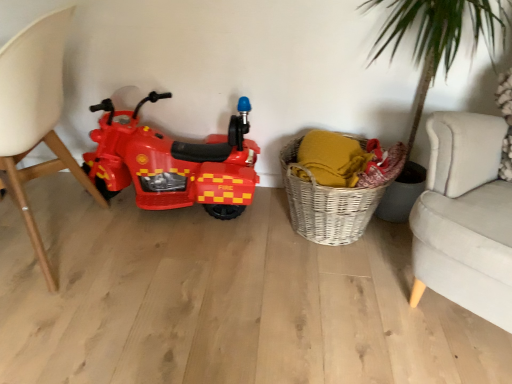
You are a GUI agent. You are given a task and a screenshot of the screen. Output one action in this format:
    pyautogui.click(x=<x>, y=<y>)
    Task: Click on the free spot below matte white chair at left (from a real-world perspective)
    
    Given the screenshot: What is the action you would take?
    pyautogui.click(x=57, y=240)